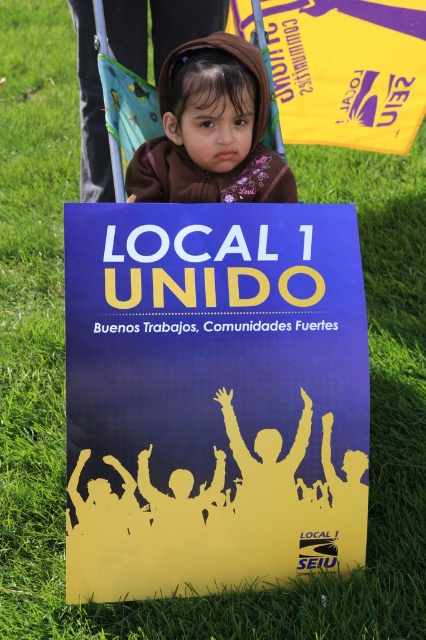
Is blue paper poster at center wider than brown fleece jacket at upper center?

Indeed, blue paper poster at center has a greater width compared to brown fleece jacket at upper center.

Can you confirm if blue paper poster at center is positioned below brown fleece jacket at upper center?

Yes.

Image resolution: width=426 pixels, height=640 pixels. Identify the location of blue paper poster at center. (213, 396).